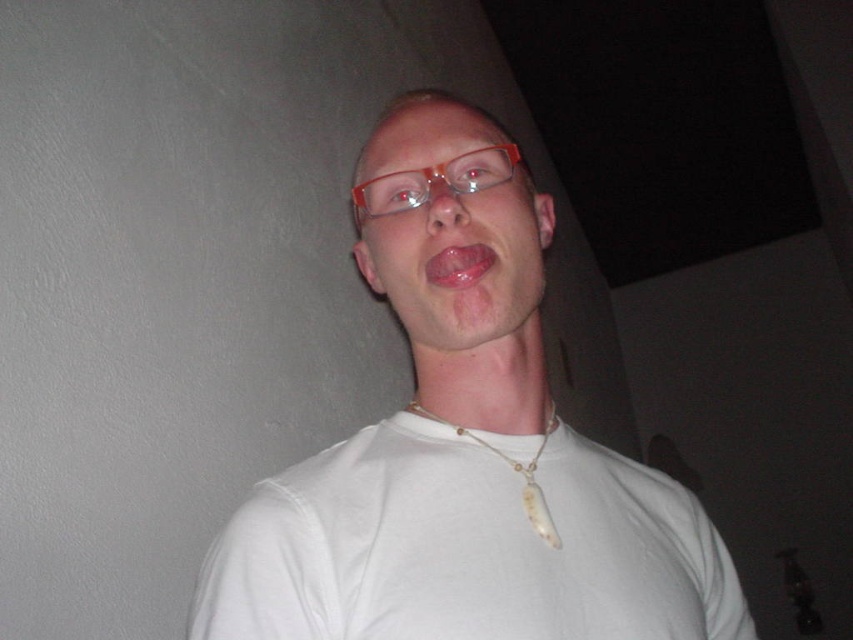
Looking at this image, you are a photographer adjusting the camera focus. The subject has a white bone necklace at center and a pink glossy tongue at center. Which object should you focus on first if you want to capture the one that is taller in the frame?

The white bone necklace at center has a greater height compared to the pink glossy tongue at center, so you should focus on the white bone necklace at center first to capture the taller object.

You are a photographer trying to capture a closeup of the person in the image. You need to focus on the white matte necklace at center and the white bone necklace at center. Which one is positioned higher on the person?

The white matte necklace at center is located above the white bone necklace at center, so it is positioned higher on the person.